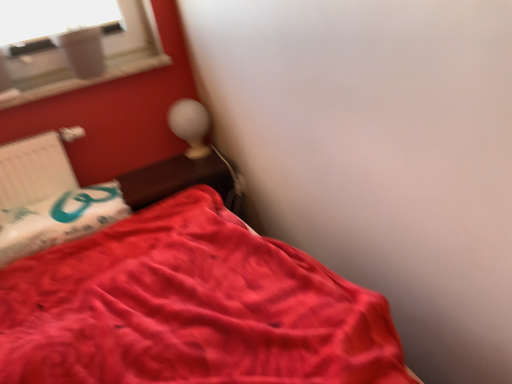
Question: Would you say satin red bed at lower left is inside or outside white plastic radiator at left?

Choices:
 (A) inside
 (B) outside

Answer: (B)

Question: Is satin red bed at lower left bigger or smaller than white plastic radiator at left?

Choices:
 (A) big
 (B) small

Answer: (A)

Question: Which of these objects is positioned farthest from the wooden table at upper center?

Choices:
 (A) satin red bed at lower left
 (B) matte white table lamp at upper center
 (C) white plastic radiator at left

Answer: (C)

Question: Which of these objects is positioned farthest from the matte white table lamp at upper center?

Choices:
 (A) satin red bed at lower left
 (B) white plastic radiator at left
 (C) wooden table at upper center

Answer: (A)